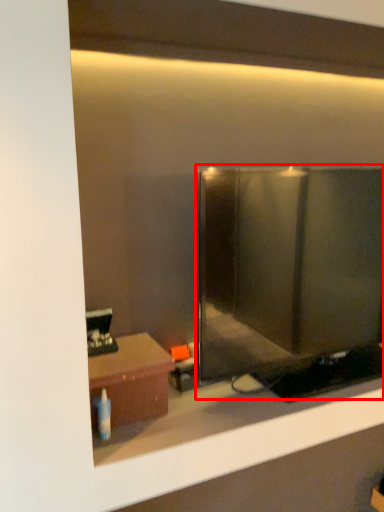
Question: In this image, where is glass door (annotated by the red box) located relative to table?

Choices:
 (A) right
 (B) left

Answer: (A)